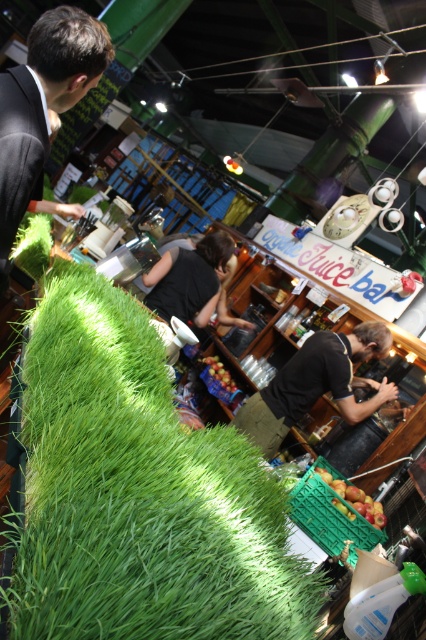
You are a customer at the juice bar and you see the black fabric apron at center and the shiny red apples at lower center. Which object is positioned higher from the ground?

The black fabric apron at center is above the shiny red apples at lower center, so it is positioned higher from the ground.

You are standing at the entrance of the juice bar and see two points marked in the image. The first point is at coordinates point (45, 58) and the second point is at point (319, 376). Which point is closer to you?

Point (45, 58) is in front of point (319, 376), so it is closer to you.

You are a customer at the juice bar and want to place your phone between the black fabric apron at center and the shiny red apples at lower center. Is there enough space to fit your phone there?

→ The black fabric apron at center and shiny red apples at lower center are 26.80 inches apart, so there is sufficient space to place your phone between them since 26.80 inches is more than enough for a typical phone.